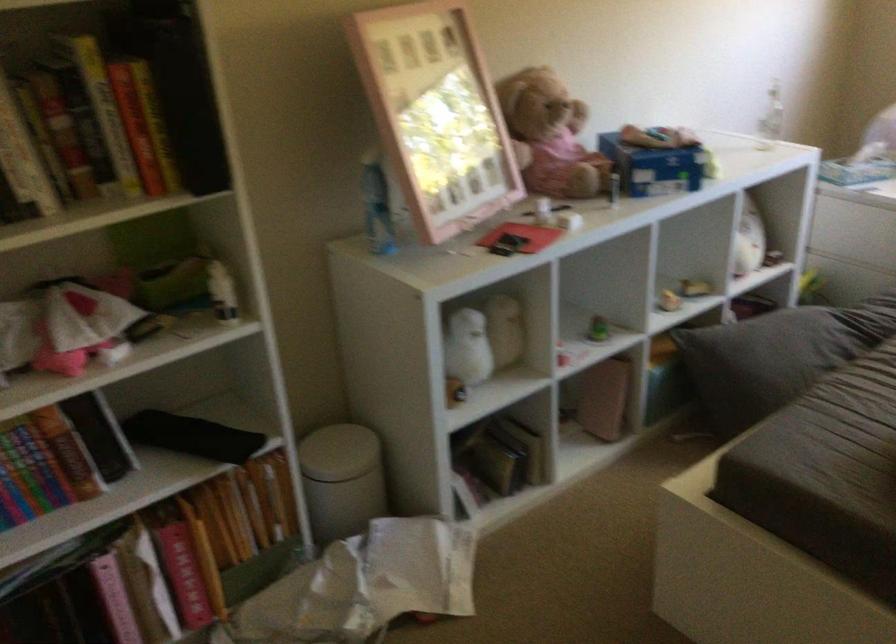
You are a GUI agent. You are given a task and a screenshot of the screen. Output one action in this format:
    pyautogui.click(x=<x>, y=<y>)
    Task: Click on the white trash can lid
    The width and height of the screenshot is (896, 644).
    Given the screenshot: What is the action you would take?
    pyautogui.click(x=341, y=480)